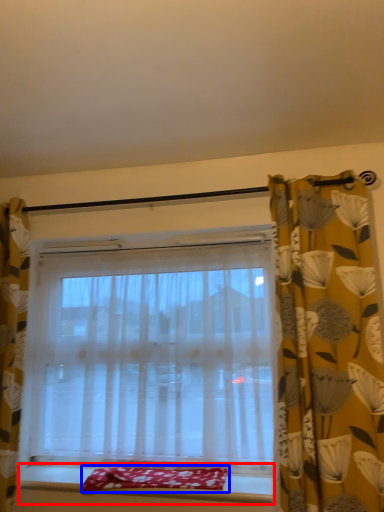
Question: Which object is further to the camera taking this photo, window sill (highlighted by a red box) or blanket (highlighted by a blue box)?

Choices:
 (A) window sill
 (B) blanket

Answer: (B)